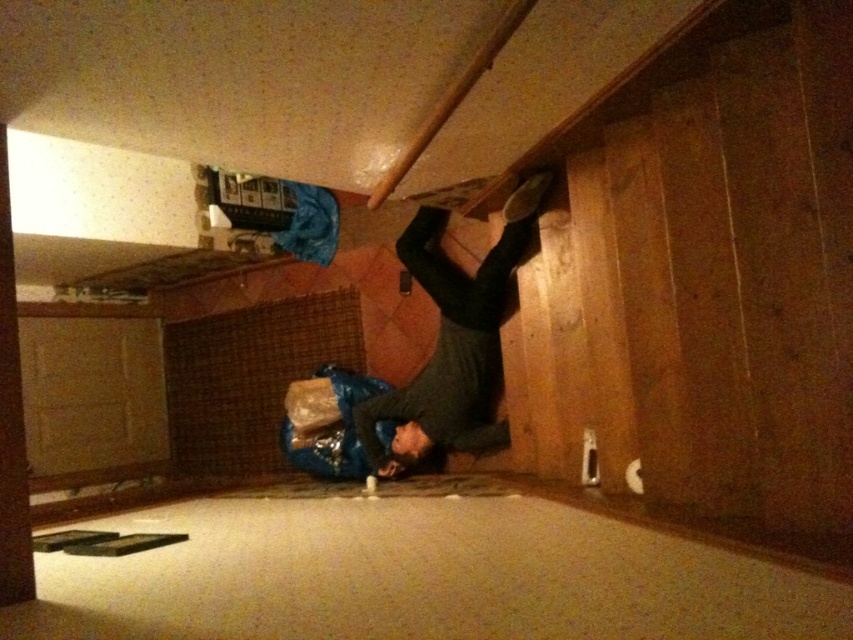
Question: Which of the following is the closest to the observer?

Choices:
 (A) (460, 600)
 (B) (378, 408)
 (C) (485, 45)

Answer: (A)

Question: Can you confirm if carpet at lower center is wider than wooden beam at upper center?

Choices:
 (A) yes
 (B) no

Answer: (A)

Question: Can you confirm if carpet at lower center is bigger than dark gray sweater at center?

Choices:
 (A) yes
 (B) no

Answer: (A)

Question: Which of the following is the farthest from the observer?

Choices:
 (A) carpet at lower center
 (B) dark gray sweater at center
 (C) wooden beam at upper center

Answer: (B)

Question: Which point is farther to the camera?

Choices:
 (A) (126, 588)
 (B) (439, 346)
 (C) (483, 52)

Answer: (B)

Question: Can you confirm if carpet at lower center is smaller than dark gray sweater at center?

Choices:
 (A) no
 (B) yes

Answer: (A)